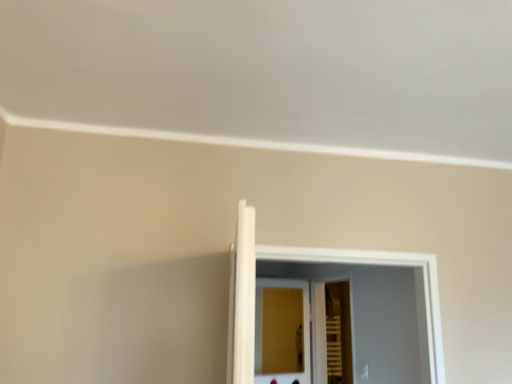
Locate an element on the screen. Image resolution: width=512 pixels, height=384 pixels. wooden slats at center, which is the 1th screen door in right-to-left order is located at coordinates (319, 333).

What do you see at coordinates (319, 333) in the screenshot? I see `wooden slats at center, which is the 1th screen door in right-to-left order` at bounding box center [319, 333].

This screenshot has width=512, height=384. Describe the element at coordinates (303, 330) in the screenshot. I see `wooden screen door at center, which appears as the 2th screen door when viewed from the right` at that location.

At what (x,y) coordinates should I click in order to perform the action: click on wooden screen door at center, which appears as the 2th screen door when viewed from the right. Please return your answer as a coordinate pair (x, y). The image size is (512, 384). Looking at the image, I should click on (303, 330).

What are the coordinates of `wooden slats at center, which is the 1th screen door in right-to-left order` in the screenshot? It's located at (319, 333).

Which object is positioned more to the right, wooden screen door at center, which appears as the 2th screen door when viewed from the right, or wooden slats at center, which is the 1th screen door in right-to-left order?

wooden slats at center, which is the 1th screen door in right-to-left order, is more to the right.

Which object is closer to the camera, wooden screen door at center, which appears as the 2th screen door when viewed from the right, or wooden slats at center, the 2th screen door positioned from the left?

Positioned in front is wooden slats at center, the 2th screen door positioned from the left.

Does point (305, 328) come closer to viewer compared to point (316, 283)?

Yes, it is.

From the picture: From the image's perspective, is wooden screen door at center, marked as the first screen door in a left-to-right arrangement, located above wooden slats at center, which is the 1th screen door in right-to-left order?

Incorrect, from the image's perspective, wooden screen door at center, marked as the first screen door in a left-to-right arrangement, is lower than wooden slats at center, which is the 1th screen door in right-to-left order.

From a real-world perspective, does wooden screen door at center, marked as the first screen door in a left-to-right arrangement, sit lower than wooden slats at center, which is the 1th screen door in right-to-left order?

Yes.

Which object is wider, wooden screen door at center, marked as the first screen door in a left-to-right arrangement, or wooden slats at center, which is the 1th screen door in right-to-left order?

Wider between the two is wooden slats at center, which is the 1th screen door in right-to-left order.

Who is shorter, wooden screen door at center, which appears as the 2th screen door when viewed from the right, or wooden slats at center, the 2th screen door positioned from the left?

wooden screen door at center, which appears as the 2th screen door when viewed from the right, is shorter.

Between wooden screen door at center, which appears as the 2th screen door when viewed from the right, and wooden slats at center, which is the 1th screen door in right-to-left order, which one has larger size?

Bigger between the two is wooden slats at center, which is the 1th screen door in right-to-left order.

Based on the photo, is wooden slats at center, the 2th screen door positioned from the left, a part of wooden screen door at center, marked as the first screen door in a left-to-right arrangement?

No.

Is wooden screen door at center, which appears as the 2th screen door when viewed from the right, far away from wooden slats at center, which is the 1th screen door in right-to-left order?

No, wooden screen door at center, which appears as the 2th screen door when viewed from the right, is in close proximity to wooden slats at center, which is the 1th screen door in right-to-left order.

Is wooden screen door at center, which appears as the 2th screen door when viewed from the right, oriented towards wooden slats at center, the 2th screen door positioned from the left?

Yes, wooden screen door at center, which appears as the 2th screen door when viewed from the right, is facing wooden slats at center, the 2th screen door positioned from the left.

Measure the distance from wooden screen door at center, which appears as the 2th screen door when viewed from the right, to wooden slats at center, the 2th screen door positioned from the left.

A distance of 28.67 inches exists between wooden screen door at center, which appears as the 2th screen door when viewed from the right, and wooden slats at center, the 2th screen door positioned from the left.

You are a GUI agent. You are given a task and a screenshot of the screen. Output one action in this format:
    pyautogui.click(x=<x>, y=<y>)
    Task: Click on the screen door that is under the wooden slats at center, which is the 1th screen door in right-to-left order (from a real-world perspective)
    The image size is (512, 384).
    Given the screenshot: What is the action you would take?
    pyautogui.click(x=303, y=330)

Can you confirm if wooden slats at center, the 2th screen door positioned from the left, is positioned to the left of wooden screen door at center, marked as the first screen door in a left-to-right arrangement?

No.

Is wooden slats at center, the 2th screen door positioned from the left, positioned before wooden screen door at center, marked as the first screen door in a left-to-right arrangement?

Yes, it is.

Which point is more forward, (313, 334) or (309, 326)?

The point (313, 334) is closer.

From the image's perspective, which is above, wooden slats at center, the 2th screen door positioned from the left, or wooden screen door at center, marked as the first screen door in a left-to-right arrangement?

wooden slats at center, the 2th screen door positioned from the left, from the image's perspective.

From a real-world perspective, is wooden slats at center, which is the 1th screen door in right-to-left order, positioned under wooden screen door at center, which appears as the 2th screen door when viewed from the right, based on gravity?

No, from a real-world perspective, wooden slats at center, which is the 1th screen door in right-to-left order, is not beneath wooden screen door at center, which appears as the 2th screen door when viewed from the right.

Which of these two, wooden slats at center, the 2th screen door positioned from the left, or wooden screen door at center, marked as the first screen door in a left-to-right arrangement, is thinner?

wooden screen door at center, marked as the first screen door in a left-to-right arrangement.

Considering the relative sizes of wooden slats at center, the 2th screen door positioned from the left, and wooden screen door at center, which appears as the 2th screen door when viewed from the right, in the image provided, is wooden slats at center, the 2th screen door positioned from the left, taller than wooden screen door at center, which appears as the 2th screen door when viewed from the right,?

Correct, wooden slats at center, the 2th screen door positioned from the left, is much taller as wooden screen door at center, which appears as the 2th screen door when viewed from the right.

Can you confirm if wooden slats at center, which is the 1th screen door in right-to-left order, is bigger than wooden screen door at center, which appears as the 2th screen door when viewed from the right?

Yes, wooden slats at center, which is the 1th screen door in right-to-left order, is bigger than wooden screen door at center, which appears as the 2th screen door when viewed from the right.

Is wooden screen door at center, which appears as the 2th screen door when viewed from the right, surrounded by wooden slats at center, which is the 1th screen door in right-to-left order?

No, wooden screen door at center, which appears as the 2th screen door when viewed from the right, is not surrounded by wooden slats at center, which is the 1th screen door in right-to-left order.

Are wooden slats at center, the 2th screen door positioned from the left, and wooden screen door at center, marked as the first screen door in a left-to-right arrangement, making contact?

wooden slats at center, the 2th screen door positioned from the left, and wooden screen door at center, marked as the first screen door in a left-to-right arrangement, are clearly separated.

Is wooden slats at center, the 2th screen door positioned from the left, oriented away from wooden screen door at center, marked as the first screen door in a left-to-right arrangement?

That's not correct — wooden slats at center, the 2th screen door positioned from the left, is not looking away from wooden screen door at center, marked as the first screen door in a left-to-right arrangement.

What's the angular difference between wooden slats at center, the 2th screen door positioned from the left, and wooden screen door at center, which appears as the 2th screen door when viewed from the right,'s facing directions?

The angular difference between wooden slats at center, the 2th screen door positioned from the left, and wooden screen door at center, which appears as the 2th screen door when viewed from the right, is 106 degrees.

At what (x,y) coordinates should I click in order to perform the action: click on screen door below the wooden slats at center, which is the 1th screen door in right-to-left order (from a real-world perspective). Please return your answer as a coordinate pair (x, y). Looking at the image, I should click on (303, 330).

Where is `screen door below the wooden slats at center, the 2th screen door positioned from the left (from the image's perspective)`? screen door below the wooden slats at center, the 2th screen door positioned from the left (from the image's perspective) is located at coordinates (303, 330).

Locate an element on the screen. The image size is (512, 384). screen door below the wooden slats at center, which is the 1th screen door in right-to-left order (from a real-world perspective) is located at coordinates (303, 330).